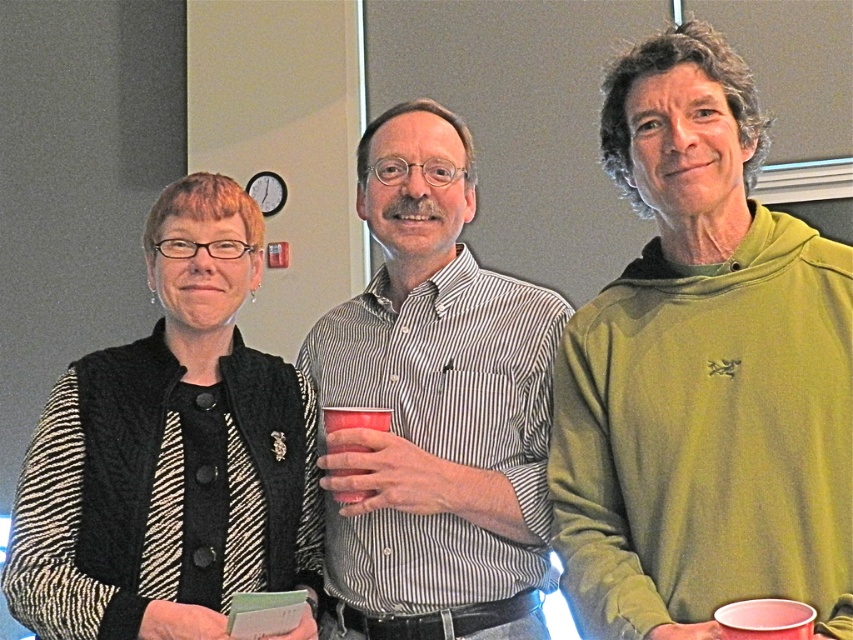
Question: Does black knitted vest at left have a smaller size compared to matte plastic cup at center?

Choices:
 (A) no
 (B) yes

Answer: (A)

Question: Is white striped shirt at center to the left of matte plastic cup at center from the viewer's perspective?

Choices:
 (A) yes
 (B) no

Answer: (B)

Question: Which object is closer to the camera taking this photo?

Choices:
 (A) green hoodie at center
 (B) matte plastic cup at center
 (C) black knitted vest at left

Answer: (A)

Question: Among these points, which one is nearest to the camera?

Choices:
 (A) (140, 557)
 (B) (428, 145)

Answer: (A)

Question: Which point is closer to the camera?

Choices:
 (A) pos(349,502)
 (B) pos(480,403)
 (C) pos(152,538)

Answer: (C)

Question: Does green hoodie at center have a lesser width compared to black knitted vest at left?

Choices:
 (A) yes
 (B) no

Answer: (A)